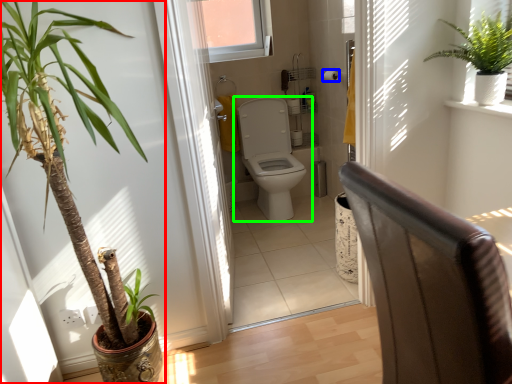
Question: Based on their relative distances, which object is nearer to houseplant (highlighted by a red box)? Choose from toilet paper (highlighted by a blue box) and toilet (highlighted by a green box).

Choices:
 (A) toilet paper
 (B) toilet

Answer: (B)